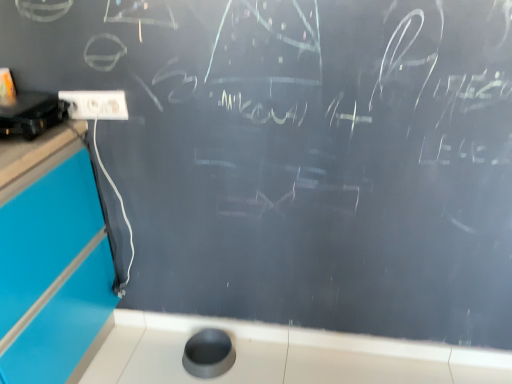
Identify the location of white glossy counter top at lower center. The image size is (512, 384). (281, 355).

The image size is (512, 384). Describe the element at coordinates (281, 355) in the screenshot. I see `white glossy counter top at lower center` at that location.

Locate an element on the screen. black plastic projector at upper left is located at coordinates (31, 114).

Where is `white glossy counter top at lower center`? The height and width of the screenshot is (384, 512). white glossy counter top at lower center is located at coordinates (281, 355).

Looking at their sizes, would you say white plastic electric outlet at upper left is wider or thinner than black plastic projector at upper left?

white plastic electric outlet at upper left is thinner than black plastic projector at upper left.

This screenshot has width=512, height=384. I want to click on appliance below the white plastic electric outlet at upper left (from the image's perspective), so click(x=31, y=114).

Is white plastic electric outlet at upper left taller than black plastic projector at upper left?

Incorrect, the height of white plastic electric outlet at upper left is not larger of that of black plastic projector at upper left.

From a real-world perspective, is white glossy counter top at lower center physically below black plastic projector at upper left?

Yes, from a real-world perspective, white glossy counter top at lower center is under black plastic projector at upper left.

From the image's perspective, between white glossy counter top at lower center and black plastic projector at upper left, which one is located above?

black plastic projector at upper left, from the image's perspective.

In the image, is white glossy counter top at lower center positioned in front of or behind black plastic projector at upper left?

In the image, white glossy counter top at lower center appears behind black plastic projector at upper left.

Is white glossy counter top at lower center oriented away from black plastic projector at upper left?

No, black plastic projector at upper left is not at the back of white glossy counter top at lower center.

Is black plastic projector at upper left facing towards white glossy counter top at lower center?

No, black plastic projector at upper left is not facing towards white glossy counter top at lower center.

Are black plastic projector at upper left and white glossy counter top at lower center beside each other?

No, black plastic projector at upper left is not next to white glossy counter top at lower center.

From the image's perspective, is black plastic projector at upper left under white glossy counter top at lower center?

Actually, black plastic projector at upper left appears above white glossy counter top at lower center in the image.

Which of these two, black plastic projector at upper left or white plastic electric outlet at upper left, is bigger?

black plastic projector at upper left is bigger.

Locate an element on the screen. This screenshot has width=512, height=384. appliance located above the white plastic electric outlet at upper left (from a real-world perspective) is located at coordinates (31, 114).

Which object is positioned more to the left, black plastic projector at upper left or white plastic electric outlet at upper left?

black plastic projector at upper left.

Which object is further away from the camera taking this photo, black plastic projector at upper left or white plastic electric outlet at upper left?

white plastic electric outlet at upper left is further from the camera.

From the picture: Does white plastic electric outlet at upper left appear on the left side of white glossy counter top at lower center?

Correct, you'll find white plastic electric outlet at upper left to the left of white glossy counter top at lower center.

Does white plastic electric outlet at upper left lie in front of white glossy counter top at lower center?

Yes.

Find the location of a particular element. This screenshot has height=384, width=512. electric outlet that appears in front of the white glossy counter top at lower center is located at coordinates (96, 105).

Between white glossy counter top at lower center and white plastic electric outlet at upper left, which one has more height?

With more height is white glossy counter top at lower center.

Can you confirm if white glossy counter top at lower center is positioned to the right of white plastic electric outlet at upper left?

Yes.

Is white glossy counter top at lower center positioned with its back to white plastic electric outlet at upper left?

white glossy counter top at lower center does not have its back to white plastic electric outlet at upper left.

Where is `electric outlet that appears below the black plastic projector at upper left (from a real-world perspective)`? This screenshot has width=512, height=384. electric outlet that appears below the black plastic projector at upper left (from a real-world perspective) is located at coordinates (96, 105).

Find the location of a particular element. This screenshot has width=512, height=384. counter top that is behind the black plastic projector at upper left is located at coordinates (281, 355).

Estimate the real-world distances between objects in this image. Which object is closer to white glossy counter top at lower center, black plastic projector at upper left or white plastic electric outlet at upper left?

white plastic electric outlet at upper left is positioned closer to the anchor white glossy counter top at lower center.

Based on their spatial positions, is white plastic electric outlet at upper left or white glossy counter top at lower center further from black plastic projector at upper left?

Based on the image, white glossy counter top at lower center appears to be further to black plastic projector at upper left.

Considering their positions, is white glossy counter top at lower center positioned closer to black plastic projector at upper left than white plastic electric outlet at upper left?

The object closer to black plastic projector at upper left is white plastic electric outlet at upper left.

Based on their spatial positions, is white glossy counter top at lower center or black plastic projector at upper left closer to white plastic electric outlet at upper left?

black plastic projector at upper left is positioned closer to the anchor white plastic electric outlet at upper left.

Estimate the real-world distances between objects in this image. Which object is further from white glossy counter top at lower center, white plastic electric outlet at upper left or black plastic projector at upper left?

black plastic projector at upper left.

When comparing their distances from white plastic electric outlet at upper left, does black plastic projector at upper left or white glossy counter top at lower center seem closer?

Based on the image, black plastic projector at upper left appears to be nearer to white plastic electric outlet at upper left.

Where is `appliance between white plastic electric outlet at upper left and white glossy counter top at lower center in the vertical direction`? appliance between white plastic electric outlet at upper left and white glossy counter top at lower center in the vertical direction is located at coordinates tap(31, 114).